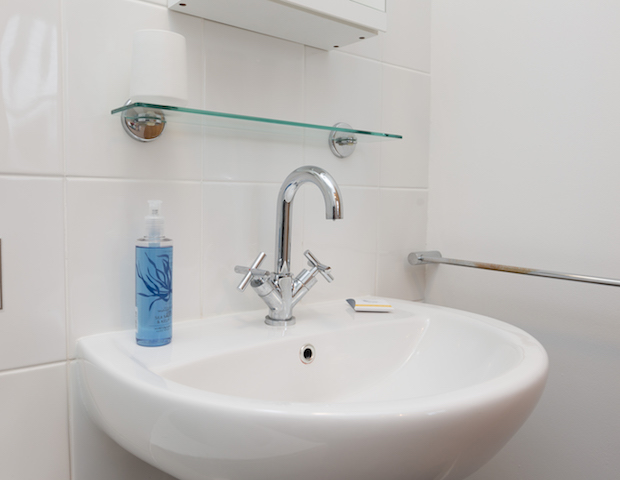
Identify the location of silver shelf holders. (143, 119), (348, 153).